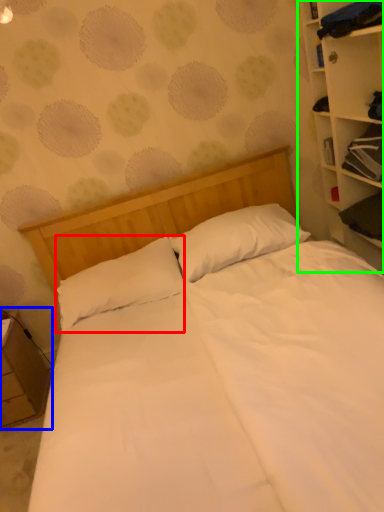
Question: Which object is positioned farthest from pillow (highlighted by a red box)? Select from nightstand (highlighted by a blue box) and bookcase (highlighted by a green box).

Choices:
 (A) nightstand
 (B) bookcase

Answer: (B)